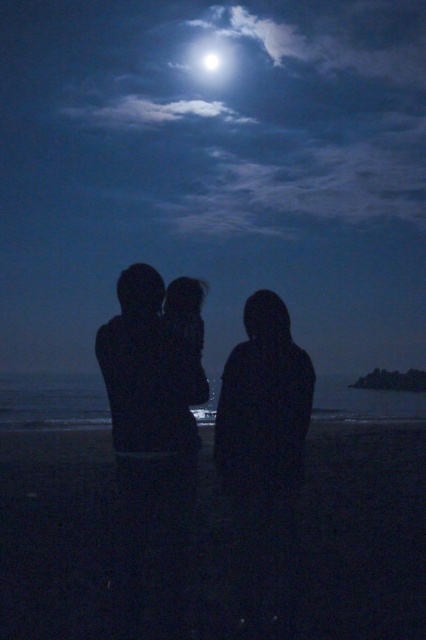
Between dark sand at lower center and bright white orb at upper center, which one has less height?

Standing shorter between the two is dark sand at lower center.

Who is more distant from viewer, (385, 509) or (219, 58)?

The point (219, 58) is behind.

What do you see at coordinates (209, 540) in the screenshot? The image size is (426, 640). I see `dark sand at lower center` at bounding box center [209, 540].

This screenshot has width=426, height=640. I want to click on dark sand at lower center, so click(x=209, y=540).

Is point (304, 490) in front of point (209, 68)?

Yes, it is.

Is point (353, 497) positioned after point (212, 60)?

That is False.

The image size is (426, 640). What are the coordinates of `dark sand at lower center` in the screenshot? It's located at (209, 540).

The image size is (426, 640). In order to click on bright white orb at upper center in this screenshot , I will do `click(210, 58)`.

Is bright white orb at upper center smaller than bright white sphere at upper center?

Incorrect, bright white orb at upper center is not smaller in size than bright white sphere at upper center.

Is point (198, 42) farther from camera compared to point (215, 61)?

Yes.

Identify the location of bright white orb at upper center. The image size is (426, 640). (210, 58).